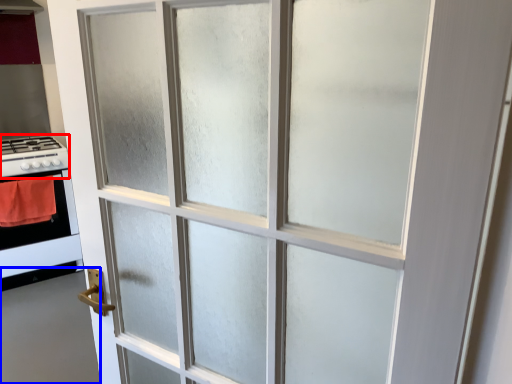
Question: Which object is closer to the camera taking this photo, gas stove (highlighted by a red box) or door (highlighted by a blue box)?

Choices:
 (A) gas stove
 (B) door

Answer: (B)